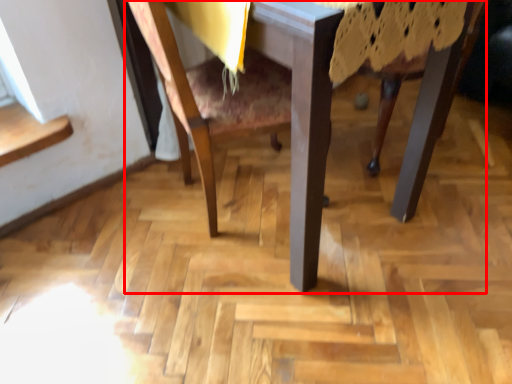
Question: In this image, where is table (annotated by the red box) located relative to chair?

Choices:
 (A) left
 (B) right

Answer: (B)